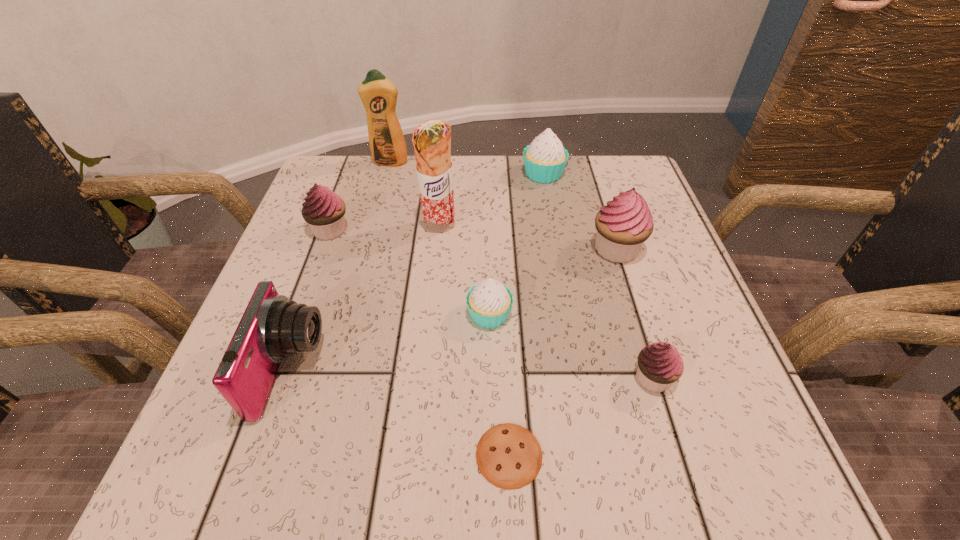
Find the location of `detergent`. detergent is located at coordinates (378, 94).

At what (x,y) coordinates should I click in order to perform the action: click on the sixth object from right to left. Please return your answer as a coordinate pair (x, y). This screenshot has width=960, height=540. Looking at the image, I should click on (432, 139).

Locate an element on the screen. This screenshot has height=540, width=960. the biggest pink cupcake is located at coordinates (622, 226).

The width and height of the screenshot is (960, 540). What are the coordinates of `the tallest cupcake` in the screenshot? It's located at (622, 226).

I want to click on the bigger white cupcake, so click(545, 158).

Image resolution: width=960 pixels, height=540 pixels. I want to click on the third cupcake from right to left, so click(x=545, y=158).

You are a GUI agent. You are given a task and a screenshot of the screen. Output one action in this format:
    pyautogui.click(x=<x>, y=<y>)
    Task: Click on the leftmost cupcake
    This screenshot has width=960, height=540.
    Given the screenshot: What is the action you would take?
    pyautogui.click(x=323, y=210)

Find the location of `the leftmost pink cupcake`. the leftmost pink cupcake is located at coordinates (323, 210).

The height and width of the screenshot is (540, 960). In order to click on camera in this screenshot , I will do tap(272, 327).

You are a GUI agent. You are given a task and a screenshot of the screen. Output one action in this format:
    pyautogui.click(x=<x>, y=<y>)
    Task: Click on the smallest pink cupcake
    The height and width of the screenshot is (540, 960).
    Given the screenshot: What is the action you would take?
    pyautogui.click(x=659, y=364)